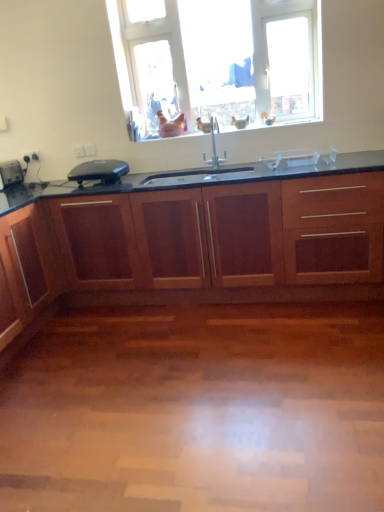
Question: Considering the positions of black plastic toaster at left, placed as the second appliance when sorted from right to left, and mahogany wood cabinetry at center in the image, is black plastic toaster at left, placed as the second appliance when sorted from right to left, wider or thinner than mahogany wood cabinetry at center?

Choices:
 (A) thin
 (B) wide

Answer: (A)

Question: From a real-world perspective, is black plastic toaster at left, placed as the second appliance when sorted from right to left, above or below mahogany wood cabinetry at center?

Choices:
 (A) below
 (B) above

Answer: (B)

Question: Which of these objects is positioned closest to the black plastic toaster at left, placed as the second appliance when sorted from right to left?

Choices:
 (A) clear plastic container at center, the third appliance in the left-to-right sequence
 (B) mahogany wood cabinetry at center
 (C) satin nickel faucet at center
 (D) transparent glass window at upper center
 (E) matte black toaster at left, arranged as the 3th appliance when viewed from the right

Answer: (E)

Question: Which is nearer to the clear plastic container at center, the third appliance in the left-to-right sequence?

Choices:
 (A) satin nickel faucet at center
 (B) matte black toaster at left, the first appliance when ordered from left to right
 (C) mahogany wood cabinetry at center
 (D) transparent glass window at upper center
 (E) black plastic toaster at left, placed as the second appliance when sorted from right to left

Answer: (A)